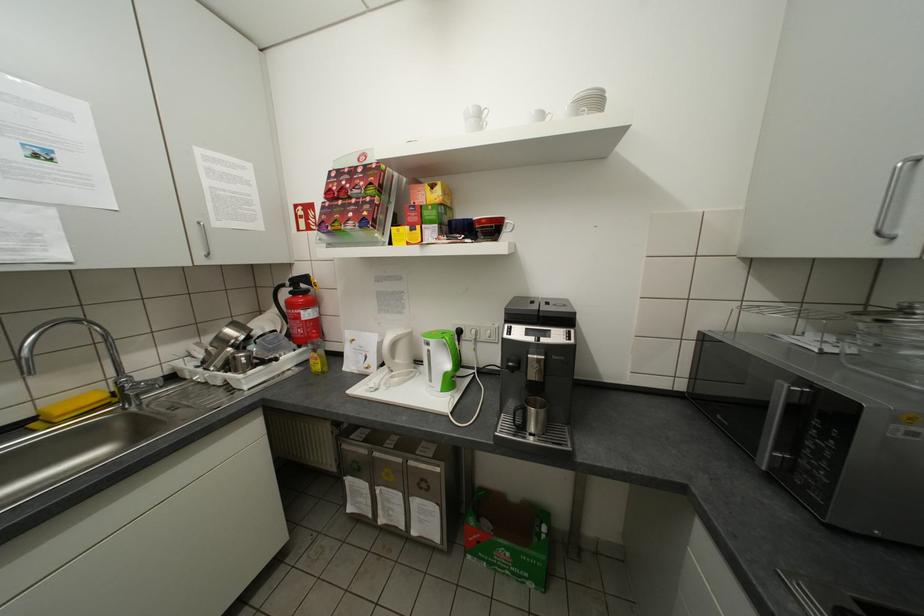
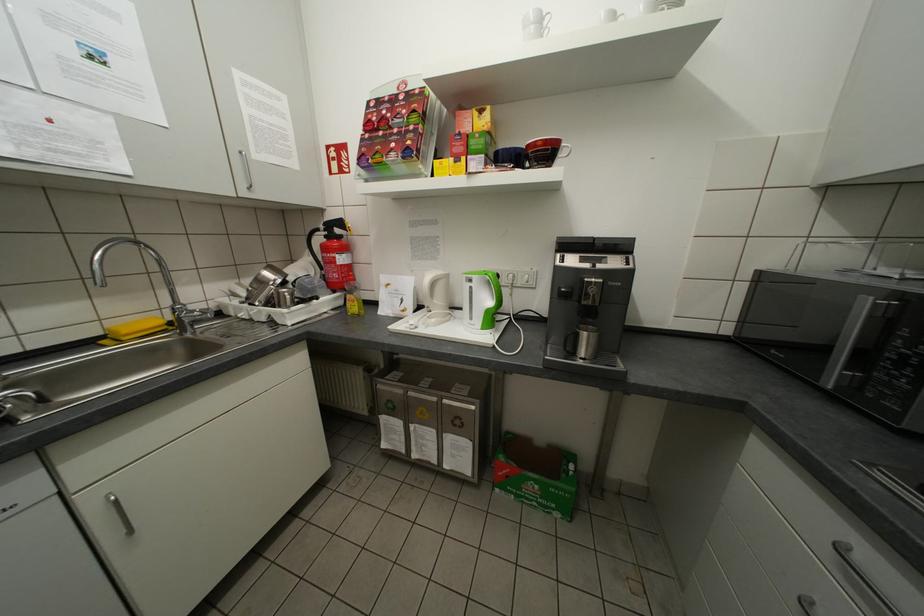
Where in the second image is the point corresponding to point 471,237 from the first image?

(521, 166)